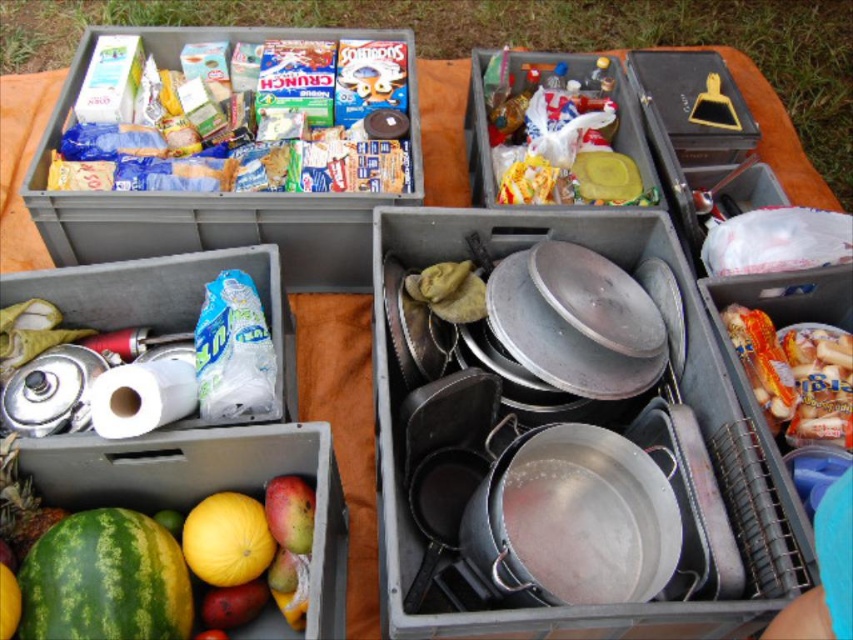
You are organizing items in the scene. If you want to place the green rind watermelon at lower left into the matte plastic crate at upper left, will it fit based on their widths?

The matte plastic crate at upper left is wider than the green rind watermelon at lower left, so it should fit inside.

You are organizing a picnic and need to stack the green matte watermelon at lower left and yellow matte melon at lower left vertically. Which one should be placed at the bottom to ensure stability?

The green matte watermelon at lower left should be placed at the bottom since it has a greater height than the yellow matte melon at lower left, providing a more stable base.

You are organizing a picnic and need to stack items vertically. You have a green matte watermelon at lower left and a green rind watermelon at lower left. Which watermelon should you choose to place at the bottom of the stack to ensure stability?

The green matte watermelon at lower left should be placed at the bottom since it has a greater height compared to the green rind watermelon at lower left, providing a more stable base for the stack.